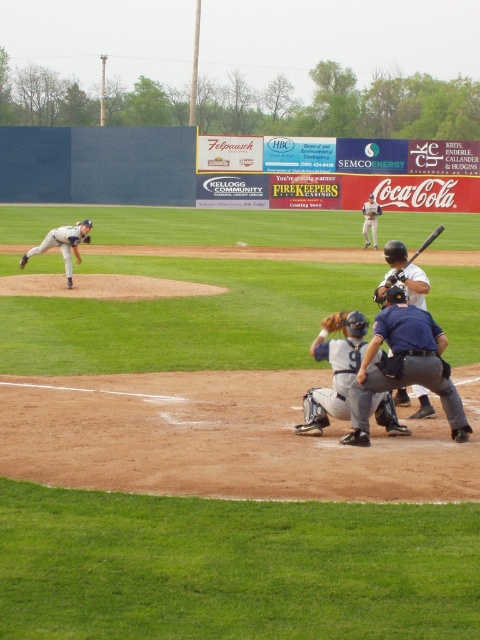
Question: Which object appears closest to the camera in this image?

Choices:
 (A) white matte baseball at center
 (B) blue padded umpire at center
 (C) white matte bat at center

Answer: (B)

Question: Can you confirm if blue padded umpire at center is positioned below white matte bat at center?

Choices:
 (A) yes
 (B) no

Answer: (A)

Question: Which point is farther to the camera?

Choices:
 (A) white matte baseball at center
 (B) gray matte catcher at lower center
 (C) white uniformed pitcher at left
 (D) black matte bat at center

Answer: (A)

Question: Where is gray matte catcher at lower center located in relation to white uniform at center in the image?

Choices:
 (A) left
 (B) right

Answer: (A)

Question: Which of these objects is positioned farthest from the gray matte catcher at lower center?

Choices:
 (A) white uniformed pitcher at left
 (B) blue padded umpire at center
 (C) white uniform at center

Answer: (C)

Question: Can you confirm if gray matte catcher at lower center is wider than black matte bat at center?

Choices:
 (A) no
 (B) yes

Answer: (A)